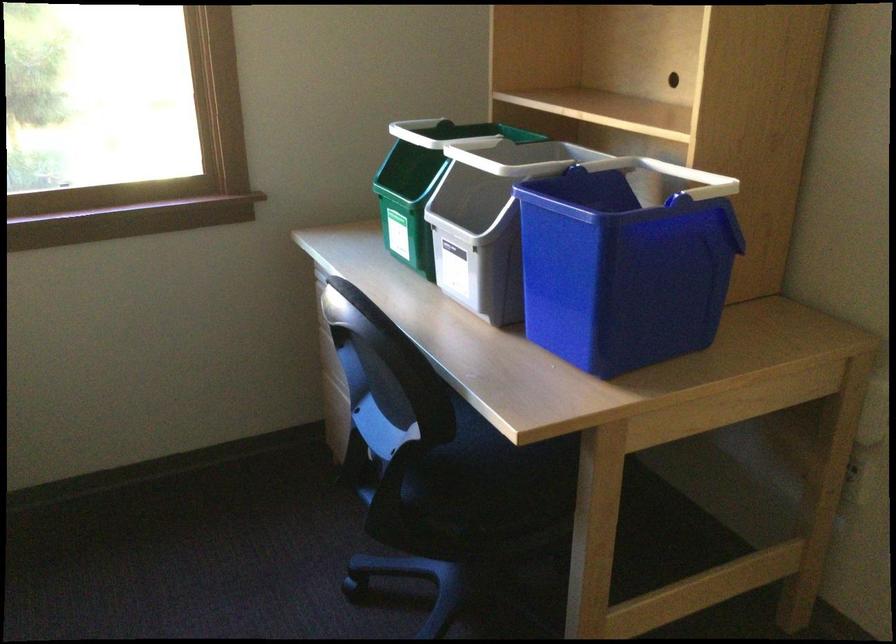
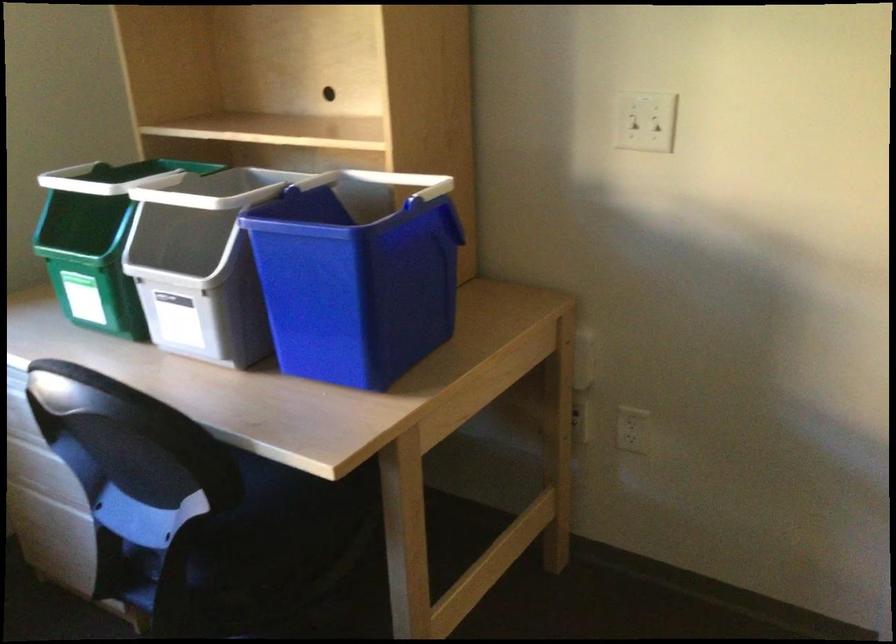
Question: The camera is either moving clockwise (left) or counter-clockwise (right) around the object. The first image is from the beginning of the video and the second image is from the end. Is the camera moving left or right when shooting the video?

Choices:
 (A) Left
 (B) Right

Answer: (A)